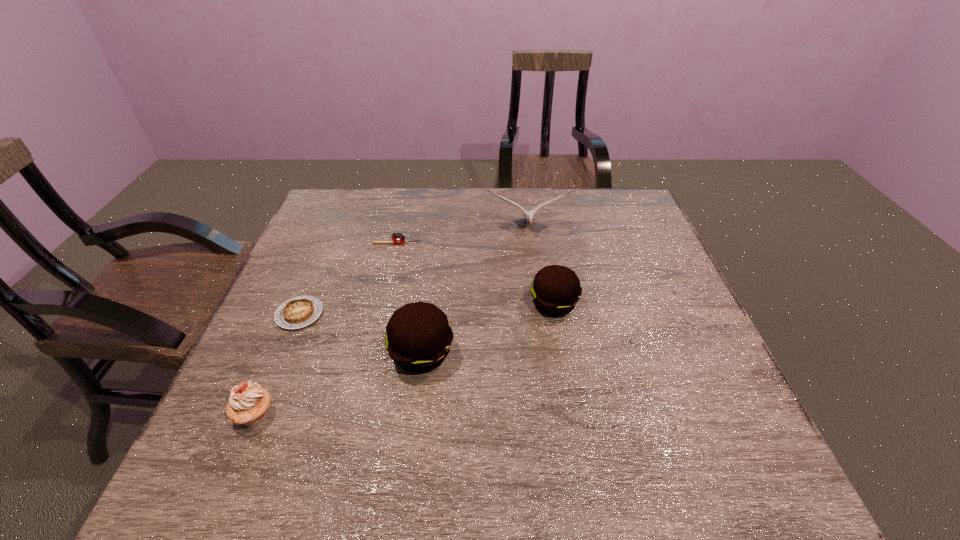
With all pattys evenly spaced, where should an extra patty be placed on the right to continue the pattern? Please point out a vacant space. Please provide its 2D coordinates. Your answer should be formatted as a tuple, i.e. [(x, y)], where the tuple contains the x and y coordinates of a point satisfying the conditions above.

[(660, 264)]